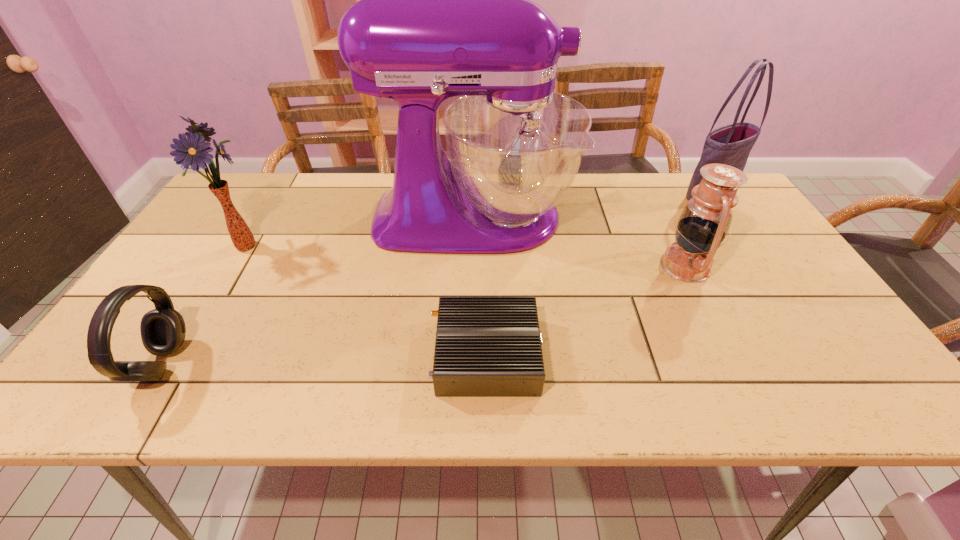
Locate an element on the screen. The image size is (960, 540). free space between the fifth tallest object and the rightmost object is located at coordinates (436, 279).

Identify the location of free space between the flower arrangement and the mixer. The width and height of the screenshot is (960, 540). (360, 232).

Identify the location of free spot between the flower arrangement and the fifth object from left to right. (466, 255).

The height and width of the screenshot is (540, 960). What are the coordinates of `free spot between the router and the oil lamp` in the screenshot? It's located at (586, 310).

The image size is (960, 540). I want to click on empty space that is in between the fourth tallest object and the flower arrangement, so click(x=466, y=255).

Identify the location of unoccupied position between the router and the tote bag. (597, 275).

I want to click on vacant space that's between the flower arrangement and the shortest object, so click(366, 300).

Find the location of `object that can be found as the fifth closest to the oil lamp`. object that can be found as the fifth closest to the oil lamp is located at coordinates (162, 329).

This screenshot has width=960, height=540. In order to click on object that stands as the closest to the mixer in this screenshot , I will do coord(705,221).

This screenshot has width=960, height=540. Identify the location of vacant space that satisfies the following two spatial constraints: 1. on the front side of the second object from right to left; 2. on the earcups of the fifth tallest object. (733, 363).